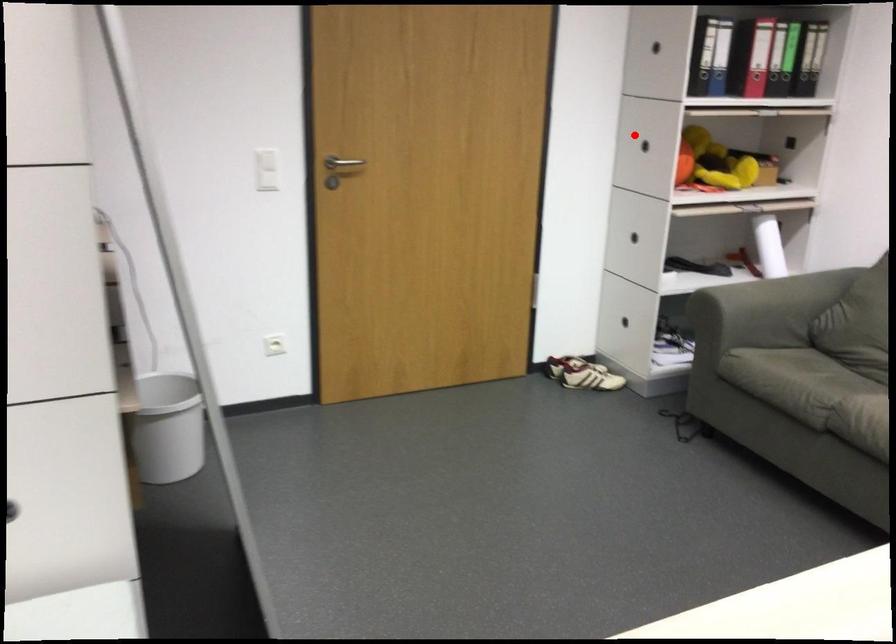
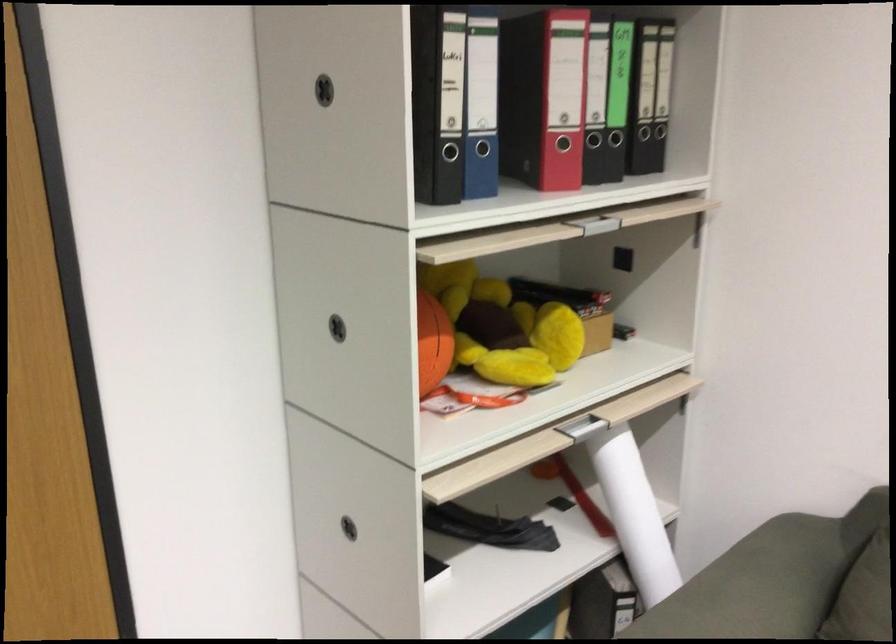
Question: I am providing you with two images of the same scene from different viewpoints. Given a red point in image1, look at the same physical point in image2. Is it:

Choices:
 (A) Closer to the viewpoint
 (B) Farther from the viewpoint

Answer: (A)